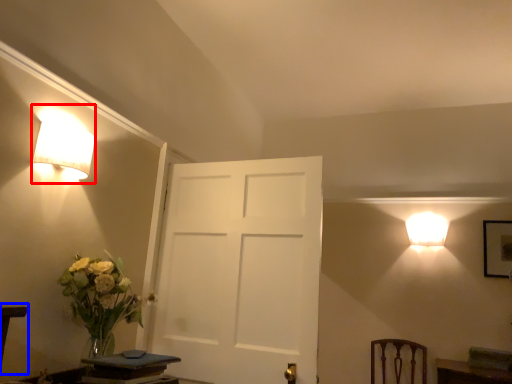
Question: Among these objects, which one is farthest to the camera, lamp (highlighted by a red box) or table (highlighted by a blue box)?

Choices:
 (A) lamp
 (B) table

Answer: (A)